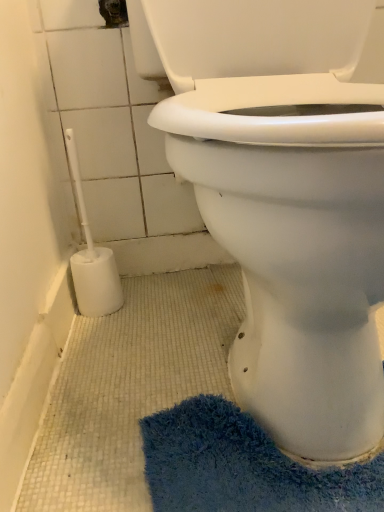
Question: From the image's perspective, is white plastic toilet brush at lower left above or below white plastic toilet brush at left?

Choices:
 (A) above
 (B) below

Answer: (B)

Question: Is white plastic toilet brush at lower left wider or thinner than white plastic toilet brush at left?

Choices:
 (A) wide
 (B) thin

Answer: (B)

Question: Estimate the real-world distances between objects in this image. Which object is closer to the white plastic toilet brush at lower left?

Choices:
 (A) white plastic toilet brush at left
 (B) blue shaggy bath mat at lower right

Answer: (B)

Question: Which object is positioned farthest from the white plastic toilet brush at left?

Choices:
 (A) blue shaggy bath mat at lower right
 (B) white plastic toilet brush at lower left

Answer: (B)